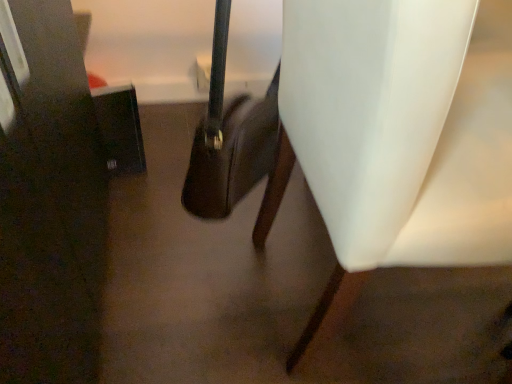
Question: Should I look upward or downward to see white matte chair at right?

Choices:
 (A) up
 (B) down

Answer: (A)